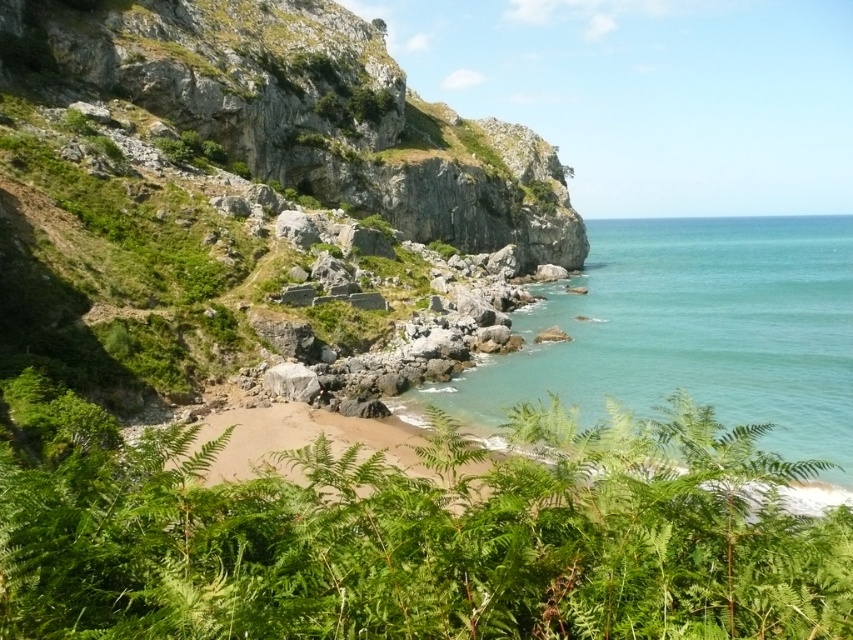
Who is more forward, (x=112, y=544) or (x=828, y=339)?

Point (x=112, y=544) is in front.

Which is behind, point (196, 634) or point (709, 384)?

Positioned behind is point (709, 384).

Identify the location of green leafy ferns at lower center. (428, 540).